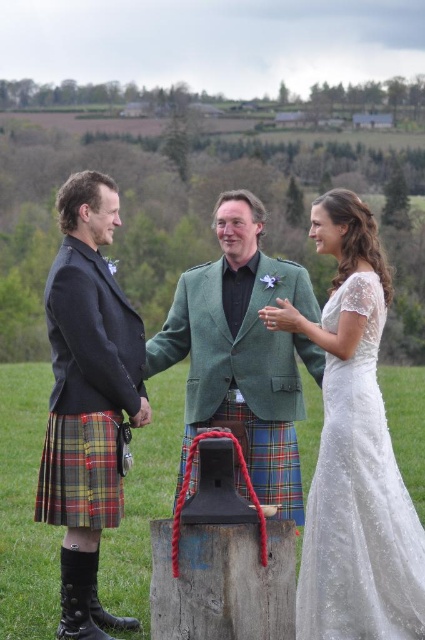
Based on the photo, you are a photographer positioned at the origin point of the image. You need to capture a closeup shot of the green wool kilt at center. According to the coordinates provided in the objects description, in which direction should you move your camera to focus on the kilt?

The green wool kilt at center is located at point (158, 371), so you should move your camera to the right and slightly upwards to focus on the kilt since the coordinates indicate it is positioned to the right and above the origin point.

You are a photographer at the wedding and want to focus on the plaid wool kilt at center and the green woolen jacket at center. Which one is closer to you?

The plaid wool kilt at center is closer to the viewer than the green woolen jacket at center.

From the picture: You are a photographer taking a picture of the wedding scene. You notice two points marked in the image. Which point, point (79,490) or point (291,362), is closer to your camera?

Point (79,490) is closer to the camera than point (291,362).